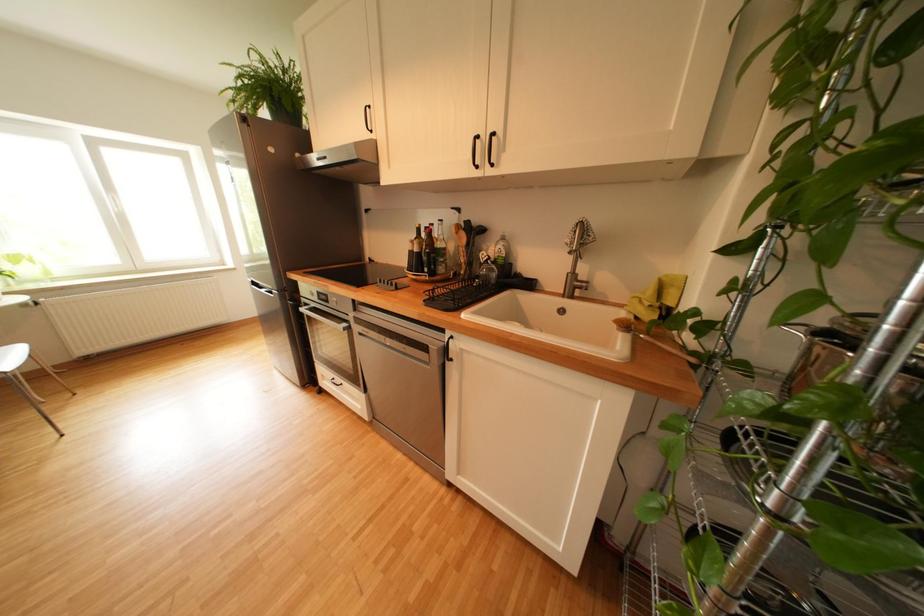
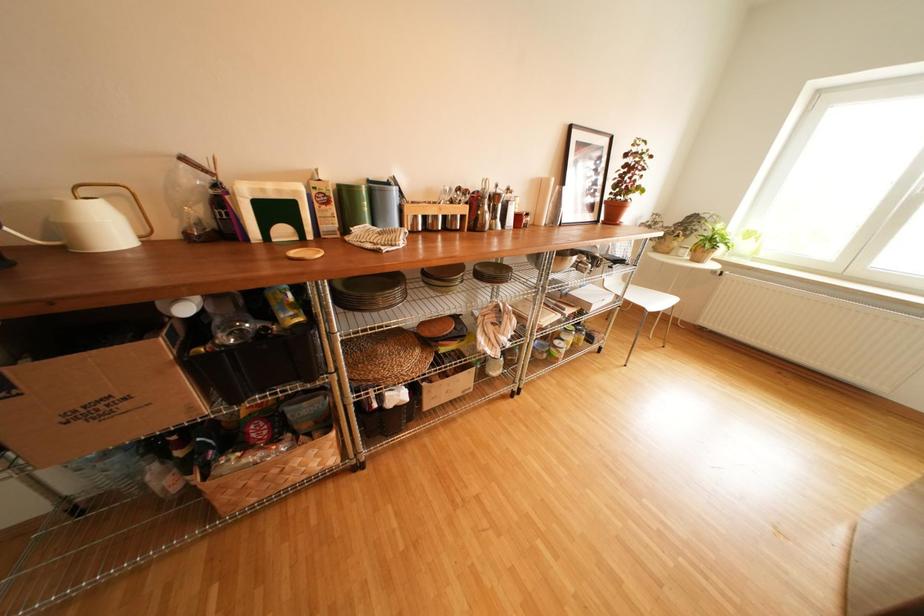
Based on the continuous images, in which direction is the camera rotating?

The camera rotated toward left-down.